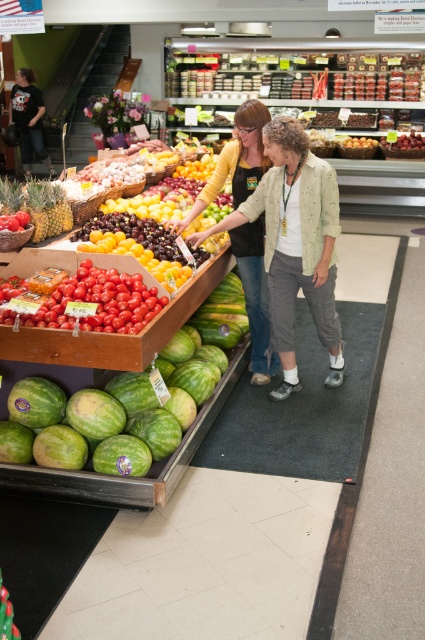
You are a customer in the grocery store and want to pick up the glossy yellow plums at center. Which direction should you move relative to the green matte watermelon at lower left?

The green matte watermelon at lower left is to the right of the glossy yellow plums at center, so you should move to the left relative to the green matte watermelon at lower left to reach the glossy yellow plums at center.